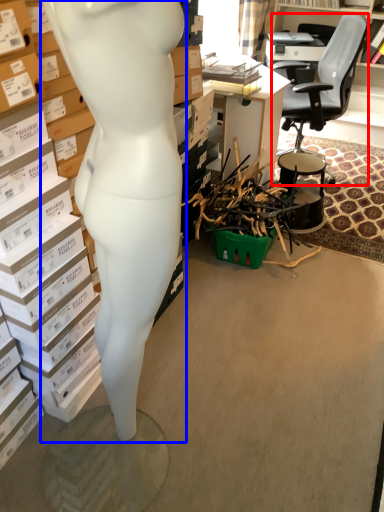
Question: Which object appears farthest to the camera in this image, chair (highlighted by a red box) or person (highlighted by a blue box)?

Choices:
 (A) chair
 (B) person

Answer: (A)